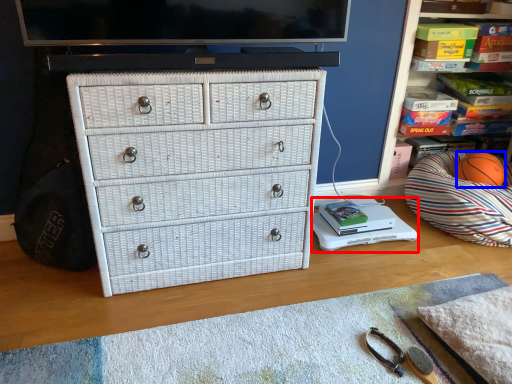
Question: Which object is further to the camera taking this photo, changing table (highlighted by a red box) or basketball (highlighted by a blue box)?

Choices:
 (A) changing table
 (B) basketball

Answer: (B)